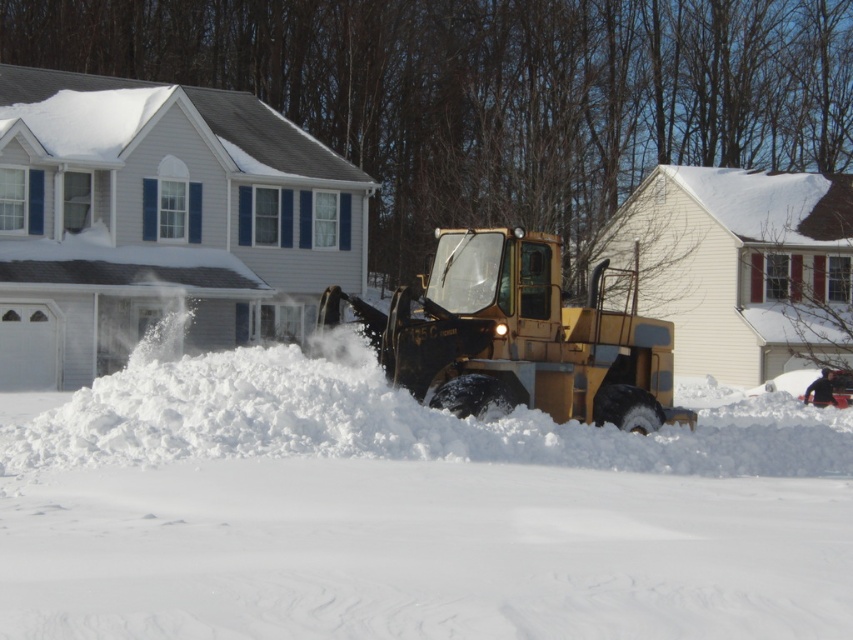
You are a delivery person trying to deliver a package to the house on the left. The white fluffy snow at center is blocking your path. Can you estimate the coordinates of the snow to determine if it is in your way?

The white fluffy snow at center is located at coordinates point (410, 515), so if your delivery route passes near this point, it might be blocking your path.

You are a delivery person trying to reach the cream house on the right. The path to it is blocked by the white fluffy snow at center and the metallic yellow tractor at center. Which obstacle is wider so you need to go around it first?

The white fluffy snow at center is wider than the metallic yellow tractor at center, so you should go around the white fluffy snow at center first.